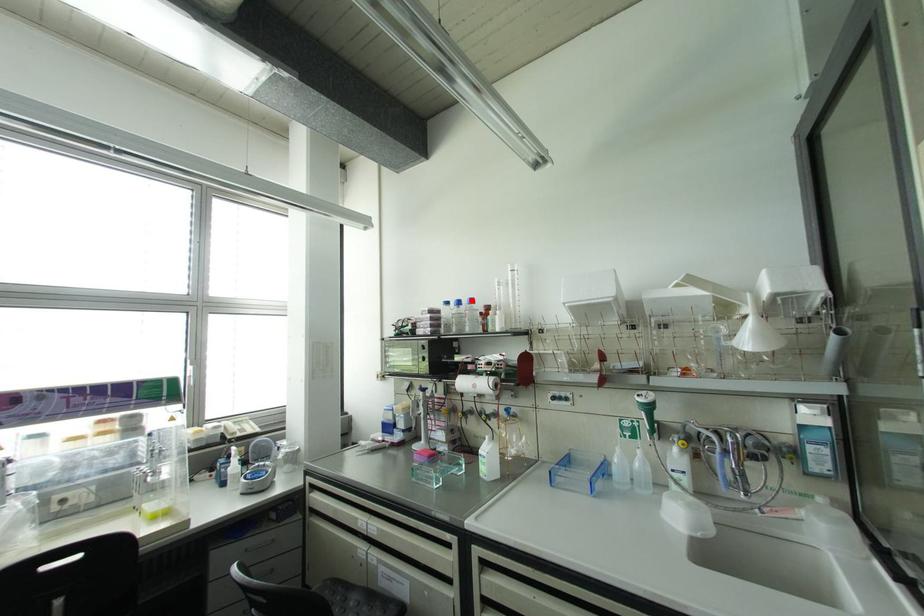
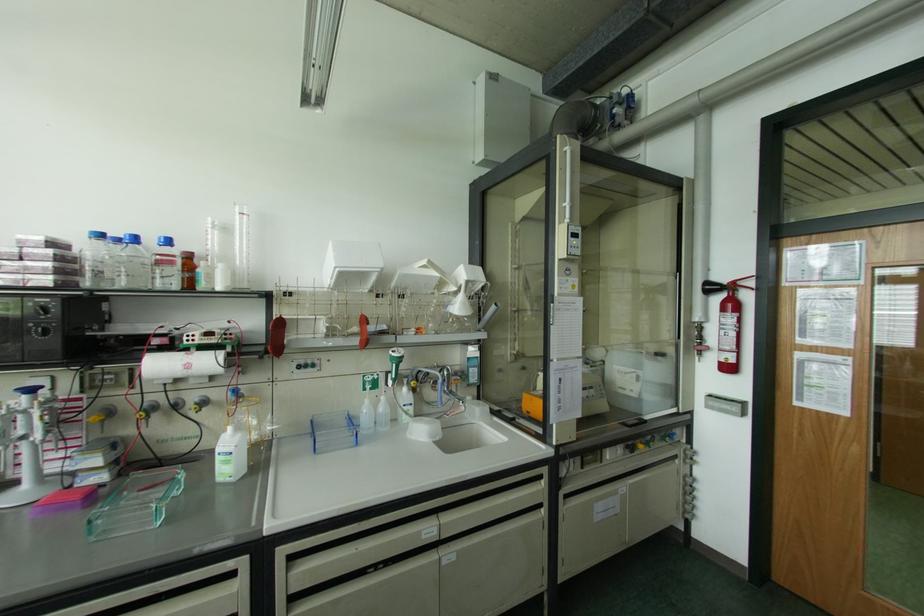
Question: I am providing you with two images of the same scene from different viewpoints. A red point is marked on the first image. At the location where the point appears in image 1, is it still visible in image 2?

Choices:
 (A) Yes
 (B) No

Answer: (A)